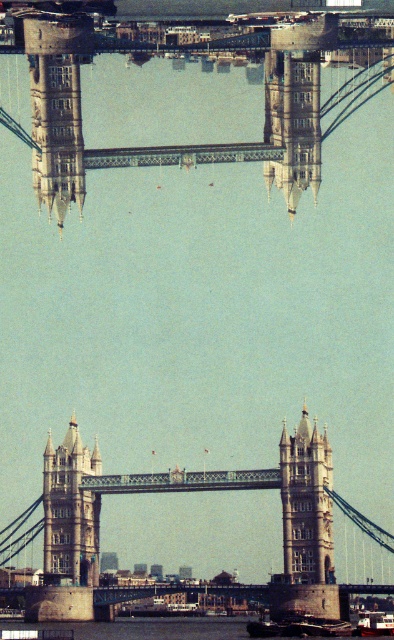
Question: In this image, where is stone stone bridge at center located relative to stone tower at center?

Choices:
 (A) below
 (B) above

Answer: (A)

Question: Which point is closer to the camera taking this photo?

Choices:
 (A) (35, 88)
 (B) (301, 458)
 (C) (91, 500)

Answer: (A)

Question: Does stone stone bridge at center appear on the left side of white plastic boat at center?

Choices:
 (A) no
 (B) yes

Answer: (B)

Question: Estimate the real-world distances between objects in this image. Which object is closer to the golden stone tower at center?

Choices:
 (A) stone gray suspension bridge at upper center
 (B) white plastic boat at center

Answer: (A)

Question: Which object is the closest to the white plastic boat at center?

Choices:
 (A) stone stone bridge at center
 (B) stone tower at center
 (C) golden stone tower at center

Answer: (B)

Question: Does stone gray suspension bridge at upper center appear over stone stone bridge at center?

Choices:
 (A) no
 (B) yes

Answer: (B)